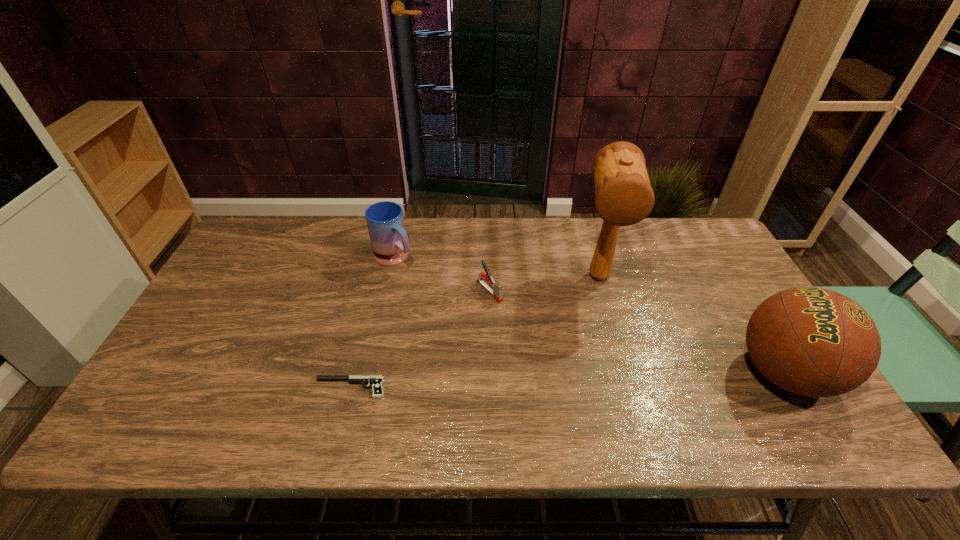
The height and width of the screenshot is (540, 960). In order to click on free space located 0.310m on the front-facing side of the pistol in this screenshot , I will do `click(184, 388)`.

I want to click on free space located on the left of the rightmost object, so click(x=656, y=373).

Where is `vacant area located 0.050m on the strike surface of the second object from right to left`? vacant area located 0.050m on the strike surface of the second object from right to left is located at coordinates coord(603,315).

Locate an element on the screen. vacant space located on the strike surface of the second object from right to left is located at coordinates (605, 341).

Locate an element on the screen. The image size is (960, 540). vacant space situated on the strike surface of the second object from right to left is located at coordinates (606, 350).

Identify the location of free region located on the side of the mug with the handle. Image resolution: width=960 pixels, height=540 pixels. (461, 320).

Find the location of a particular element. This screenshot has height=540, width=960. free location located 0.100m on the side of the mug with the handle is located at coordinates (424, 287).

Image resolution: width=960 pixels, height=540 pixels. Find the location of `vacant space located 0.180m on the side of the mug with the handle`. vacant space located 0.180m on the side of the mug with the handle is located at coordinates (442, 302).

Locate an element on the screen. vacant region located 0.170m on the handle side of the fourth tallest object is located at coordinates (538, 339).

You are a GUI agent. You are given a task and a screenshot of the screen. Output one action in this format:
    pyautogui.click(x=<x>, y=<y>)
    Task: Click on the vacant space situated on the handle side of the fourth tallest object
    The image size is (960, 540).
    Given the screenshot: What is the action you would take?
    pyautogui.click(x=593, y=393)